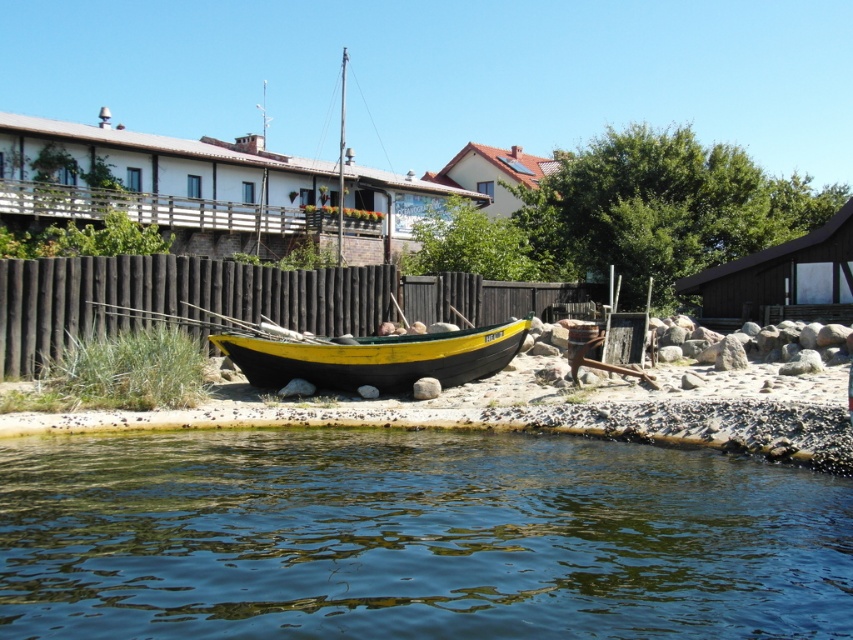
You are standing at the point marked by coordinates point (415, 538) in the coastal scene. What is the immediate environment around you like?

The transparent water at lower center is represented by point 0.847, so you are standing in transparent water at lower center.